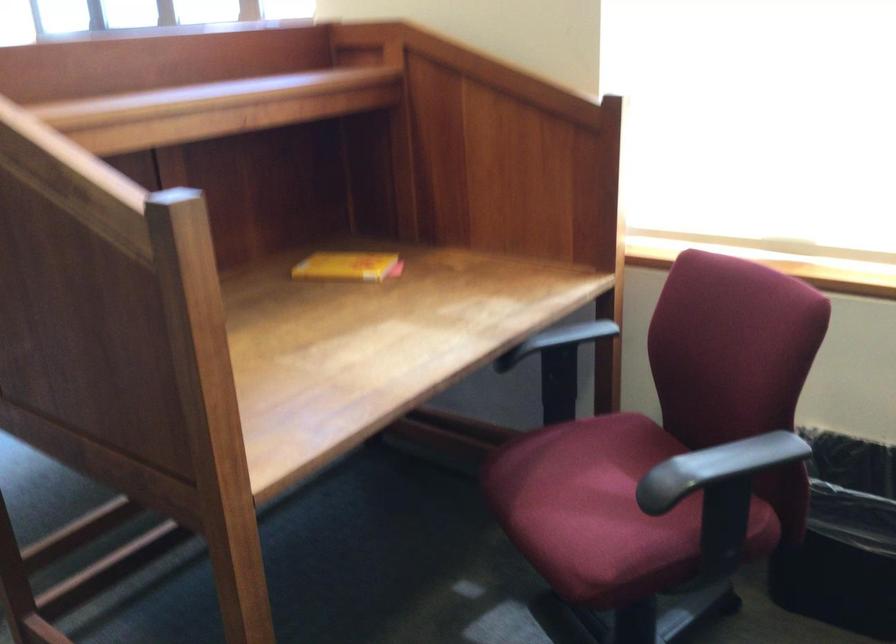
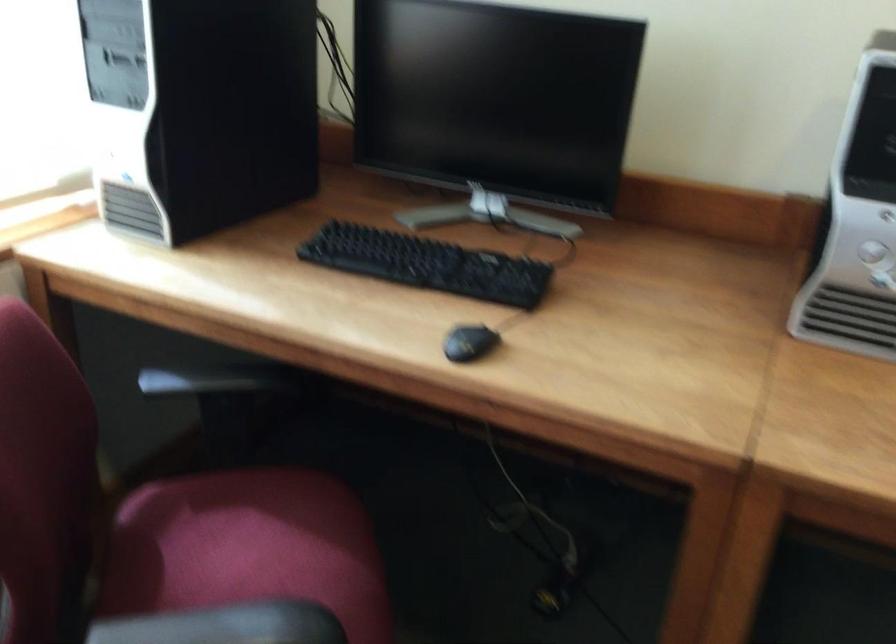
First-person continuous shooting, in which direction is the camera rotating?

The camera's rotation is toward right-down.